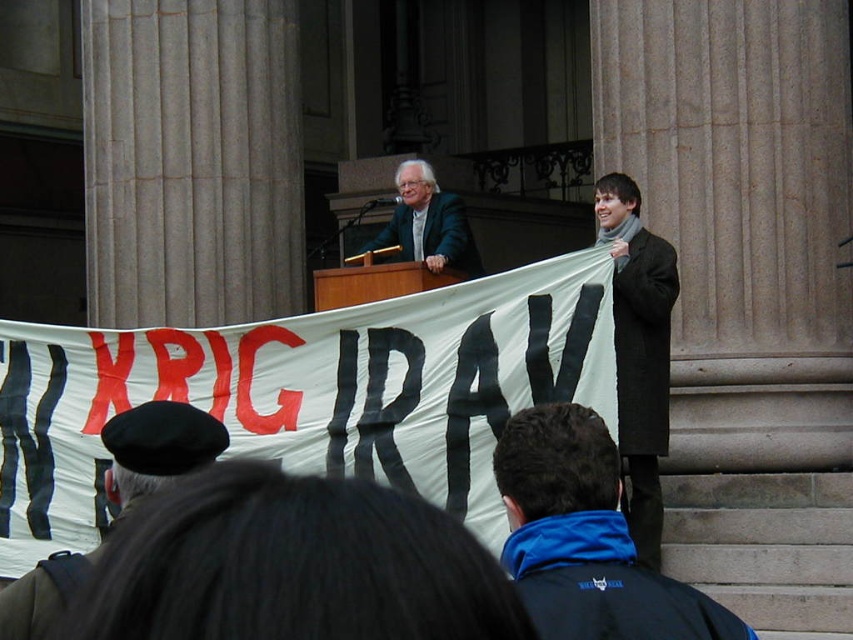
You are a photographer at the event and need to capture a clear shot of the blue fleece jacket at lower center and the matte black suit at center. Which of the two items would require a wider lens aperture to ensure proper focus, considering their sizes?

The matte black suit at center requires a wider lens aperture because it is thicker than the blue fleece jacket at lower center, necessitating a larger aperture to achieve proper focus.